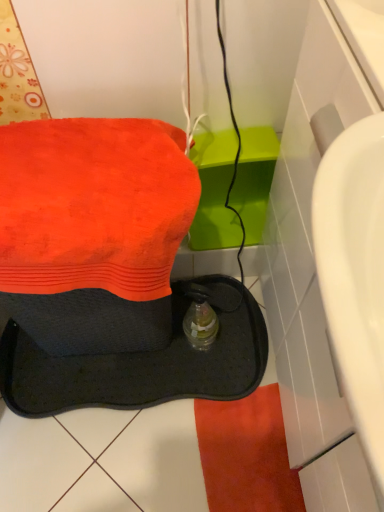
I want to click on empty space that is to the right of translucent plastic bottle at center, so click(x=241, y=340).